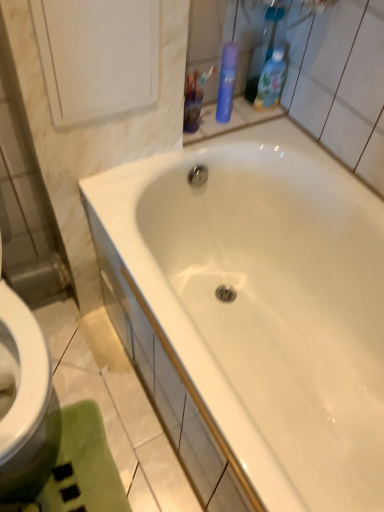
At what (x,y) coordinates should I click in order to perform the action: click on white glossy medicine cabinet at upper left. Please return your answer as a coordinate pair (x, y). The width and height of the screenshot is (384, 512). Looking at the image, I should click on (97, 56).

This screenshot has height=512, width=384. What do you see at coordinates (70, 466) in the screenshot?
I see `green plush bath mat at lower left` at bounding box center [70, 466].

Measure the distance between point (76, 485) and camera.

Point (76, 485) is 1.13 meters from camera.

Describe the element at coordinates (254, 314) in the screenshot. This screenshot has height=512, width=384. I see `white glossy bathtub at center` at that location.

Image resolution: width=384 pixels, height=512 pixels. What are the coordinates of `translucent plastic cup at upper center` in the screenshot? It's located at (194, 98).

Is point (196, 88) farther from viewer compared to point (263, 106)?

No, it is in front of (263, 106).

Is translucent plastic cup at upper center turned away from blue glossy bottle at upper right, marked as the 2th cleaning product in a left-to-right arrangement?

That's not correct — translucent plastic cup at upper center is not looking away from blue glossy bottle at upper right, marked as the 2th cleaning product in a left-to-right arrangement.

Is translucent plastic cup at upper center taller or shorter than blue glossy bottle at upper right, the 1th cleaning product when ordered from right to left?

Considering their sizes, translucent plastic cup at upper center has less height than blue glossy bottle at upper right, the 1th cleaning product when ordered from right to left.

Which object is positioned more to the left, translucent plastic cup at upper center or blue glossy bottle at upper right, the 1th cleaning product when ordered from right to left?

From the viewer's perspective, translucent plastic cup at upper center appears more on the left side.

Who is smaller, translucent plastic cup at upper center or white glossy medicine cabinet at upper left?

With smaller size is translucent plastic cup at upper center.

Is translucent plastic cup at upper center positioned in front of white glossy medicine cabinet at upper left?

No, translucent plastic cup at upper center is further to the viewer.

Is translucent plastic cup at upper center shorter than white glossy medicine cabinet at upper left?

Yes.

Does translucent plastic cup at upper center have a greater width compared to white glossy medicine cabinet at upper left?

Yes, translucent plastic cup at upper center is wider than white glossy medicine cabinet at upper left.

Which of these two, green plush bath mat at lower left or blue matte spray can at upper right, marked as the first cleaning product in a left-to-right arrangement, stands taller?

blue matte spray can at upper right, marked as the first cleaning product in a left-to-right arrangement.

Could you tell me if green plush bath mat at lower left is turned towards blue matte spray can at upper right, which is the 2th cleaning product from right to left?

No, green plush bath mat at lower left is not oriented towards blue matte spray can at upper right, which is the 2th cleaning product from right to left.

Does green plush bath mat at lower left touch blue matte spray can at upper right, marked as the first cleaning product in a left-to-right arrangement?

No, green plush bath mat at lower left is not in contact with blue matte spray can at upper right, marked as the first cleaning product in a left-to-right arrangement.

Based on the photo, considering the relative sizes of green plush bath mat at lower left and blue matte spray can at upper right, which is the 2th cleaning product from right to left, in the image provided, is green plush bath mat at lower left smaller than blue matte spray can at upper right, which is the 2th cleaning product from right to left,?

No, green plush bath mat at lower left is not smaller than blue matte spray can at upper right, which is the 2th cleaning product from right to left.

Is blue matte spray can at upper right, marked as the first cleaning product in a left-to-right arrangement, shorter than green plush bath mat at lower left?

In fact, blue matte spray can at upper right, marked as the first cleaning product in a left-to-right arrangement, may be taller than green plush bath mat at lower left.

Is blue matte spray can at upper right, which is the 2th cleaning product from right to left, positioned with its back to green plush bath mat at lower left?

No, blue matte spray can at upper right, which is the 2th cleaning product from right to left,'s orientation is not away from green plush bath mat at lower left.

From a real-world perspective, between blue matte spray can at upper right, which is the 2th cleaning product from right to left, and green plush bath mat at lower left, who is vertically lower?

From a 3D spatial view, green plush bath mat at lower left is below.

Is blue matte spray can at upper right, which is the 2th cleaning product from right to left, directly adjacent to green plush bath mat at lower left?

No.

From a real-world perspective, is translucent plastic cup at upper center physically located above or below blue matte spray can at upper right, marked as the first cleaning product in a left-to-right arrangement?

Clearly, from a real-world perspective, translucent plastic cup at upper center is below blue matte spray can at upper right, marked as the first cleaning product in a left-to-right arrangement.

Would you say translucent plastic cup at upper center contains blue matte spray can at upper right, which is the 2th cleaning product from right to left?

No, blue matte spray can at upper right, which is the 2th cleaning product from right to left, is located outside of translucent plastic cup at upper center.

From the image's perspective, is translucent plastic cup at upper center over blue matte spray can at upper right, which is the 2th cleaning product from right to left?

No, from the image's perspective, translucent plastic cup at upper center is not over blue matte spray can at upper right, which is the 2th cleaning product from right to left.

Is translucent plastic cup at upper center wider than blue matte spray can at upper right, which is the 2th cleaning product from right to left?

Yes.

Based on the photo, does blue matte spray can at upper right, marked as the first cleaning product in a left-to-right arrangement, come in front of white glossy medicine cabinet at upper left?

No.

From a real-world perspective, between blue matte spray can at upper right, which is the 2th cleaning product from right to left, and white glossy medicine cabinet at upper left, who is vertically lower?

blue matte spray can at upper right, which is the 2th cleaning product from right to left, is physically lower.

From the image's perspective, is blue matte spray can at upper right, marked as the first cleaning product in a left-to-right arrangement, on white glossy medicine cabinet at upper left?

Yes, from the image's perspective, blue matte spray can at upper right, marked as the first cleaning product in a left-to-right arrangement, is over white glossy medicine cabinet at upper left.

Would you consider translucent plastic cup at upper center to be distant from green plush bath mat at lower left?

That's not correct — translucent plastic cup at upper center is a little close to green plush bath mat at lower left.

From a real-world perspective, relative to green plush bath mat at lower left, is translucent plastic cup at upper center vertically above or below?

In terms of real-world spatial position, translucent plastic cup at upper center is above green plush bath mat at lower left.

Is translucent plastic cup at upper center turned away from green plush bath mat at lower left?

translucent plastic cup at upper center is not turned away from green plush bath mat at lower left.

The image size is (384, 512). I want to click on mouthwash that appears below the blue glossy bottle at upper right, marked as the 2th cleaning product in a left-to-right arrangement (from a real-world perspective), so click(x=194, y=98).

This screenshot has height=512, width=384. What are the coordinates of `mouthwash that appears on the right of white glossy medicine cabinet at upper left` in the screenshot? It's located at (194, 98).

Which object lies nearer to the anchor point white glossy medicine cabinet at upper left, blue matte spray can at upper right, marked as the first cleaning product in a left-to-right arrangement, or green plush bath mat at lower left?

The object closer to white glossy medicine cabinet at upper left is blue matte spray can at upper right, marked as the first cleaning product in a left-to-right arrangement.

Considering their positions, is blue matte spray can at upper right, which is the 2th cleaning product from right to left, positioned closer to blue glossy bottle at upper right, marked as the 2th cleaning product in a left-to-right arrangement, than translucent plastic cup at upper center?

Based on the image, blue matte spray can at upper right, which is the 2th cleaning product from right to left, appears to be nearer to blue glossy bottle at upper right, marked as the 2th cleaning product in a left-to-right arrangement.

From the image, which object appears to be farther from translucent plastic cup at upper center, blue glossy bottle at upper right, marked as the 2th cleaning product in a left-to-right arrangement, or white glossy bathtub at center?

white glossy bathtub at center is further to translucent plastic cup at upper center.

Looking at this image, considering their positions, is blue matte spray can at upper right, marked as the first cleaning product in a left-to-right arrangement, positioned closer to white glossy medicine cabinet at upper left than white glossy bathtub at center?

blue matte spray can at upper right, marked as the first cleaning product in a left-to-right arrangement, lies closer to white glossy medicine cabinet at upper left than the other object.

Consider the image. When comparing their distances from translucent plastic cup at upper center, does white glossy medicine cabinet at upper left or blue glossy bottle at upper right, the 1th cleaning product when ordered from right to left, seem further?

white glossy medicine cabinet at upper left lies further to translucent plastic cup at upper center than the other object.

Which object lies further to the anchor point green plush bath mat at lower left, blue glossy bottle at upper right, the 1th cleaning product when ordered from right to left, or blue matte spray can at upper right, which is the 2th cleaning product from right to left?

blue glossy bottle at upper right, the 1th cleaning product when ordered from right to left, is further to green plush bath mat at lower left.

When comparing their distances from translucent plastic cup at upper center, does white glossy bathtub at center or blue matte spray can at upper right, marked as the first cleaning product in a left-to-right arrangement, seem closer?

Based on the image, blue matte spray can at upper right, marked as the first cleaning product in a left-to-right arrangement, appears to be nearer to translucent plastic cup at upper center.

From the image, which object appears to be nearer to white glossy bathtub at center, green plush bath mat at lower left or translucent plastic cup at upper center?

Based on the image, translucent plastic cup at upper center appears to be nearer to white glossy bathtub at center.

What are the coordinates of `bathtub between blue glossy bottle at upper right, marked as the 2th cleaning product in a left-to-right arrangement, and green plush bath mat at lower left vertically` in the screenshot? It's located at (254, 314).

Identify the location of bathtub that lies between translucent plastic cup at upper center and green plush bath mat at lower left from top to bottom. The width and height of the screenshot is (384, 512). (254, 314).

This screenshot has height=512, width=384. Find the location of `cleaning product located between translucent plastic cup at upper center and blue glossy bottle at upper right, marked as the 2th cleaning product in a left-to-right arrangement, in the left-right direction`. cleaning product located between translucent plastic cup at upper center and blue glossy bottle at upper right, marked as the 2th cleaning product in a left-to-right arrangement, in the left-right direction is located at coordinates pyautogui.click(x=226, y=82).

Find the location of a particular element. The image size is (384, 512). mouthwash between blue matte spray can at upper right, which is the 2th cleaning product from right to left, and white glossy bathtub at center in the up-down direction is located at coordinates (194, 98).